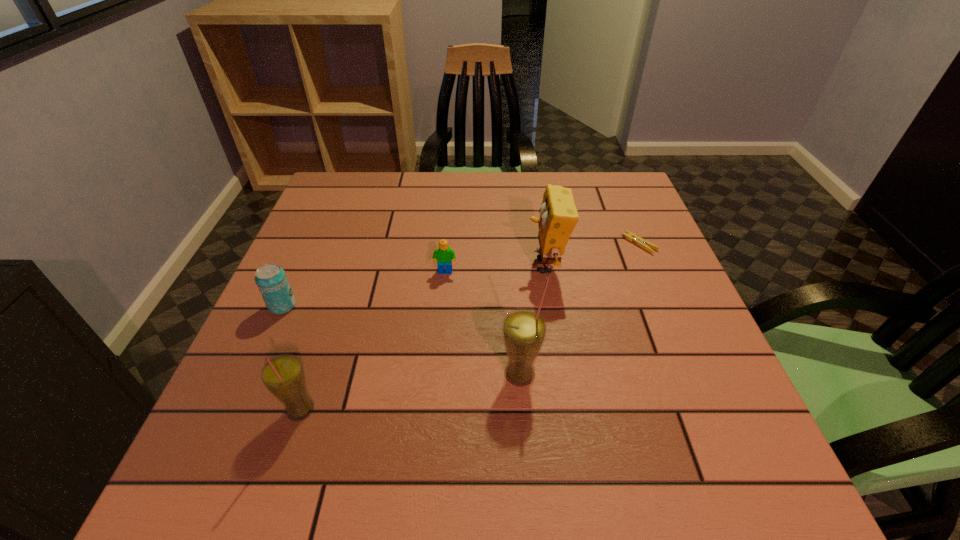
The width and height of the screenshot is (960, 540). Find the location of `object that is at the near left corner`. object that is at the near left corner is located at coordinates (283, 376).

You are a GUI agent. You are given a task and a screenshot of the screen. Output one action in this format:
    pyautogui.click(x=<x>, y=<y>)
    Task: Click on the free region at the far edge of the desktop
    
    Given the screenshot: What is the action you would take?
    pyautogui.click(x=550, y=183)

In the image, there is a desktop. Identify the location of vacant space at the near edge. Image resolution: width=960 pixels, height=540 pixels. (471, 395).

Locate an element on the screen. This screenshot has height=540, width=960. vacant space at the left edge is located at coordinates (296, 282).

Where is `vacant space at the right edge of the desktop`? Image resolution: width=960 pixels, height=540 pixels. vacant space at the right edge of the desktop is located at coordinates (683, 303).

Image resolution: width=960 pixels, height=540 pixels. In the image, there is a desktop. Find the location of `vacant space at the far right corner`. vacant space at the far right corner is located at coordinates (612, 210).

Locate an element on the screen. vacant area between the Lego and the leftmost object is located at coordinates (364, 289).

The width and height of the screenshot is (960, 540). Identify the location of free point between the farther straw for drinking and the shorter straw for drinking. (410, 392).

Find the location of `vacant point located between the rightmost object and the sponge`. vacant point located between the rightmost object and the sponge is located at coordinates (592, 255).

Where is `vacant area between the clothespin and the sponge`? Image resolution: width=960 pixels, height=540 pixels. vacant area between the clothespin and the sponge is located at coordinates (592, 255).